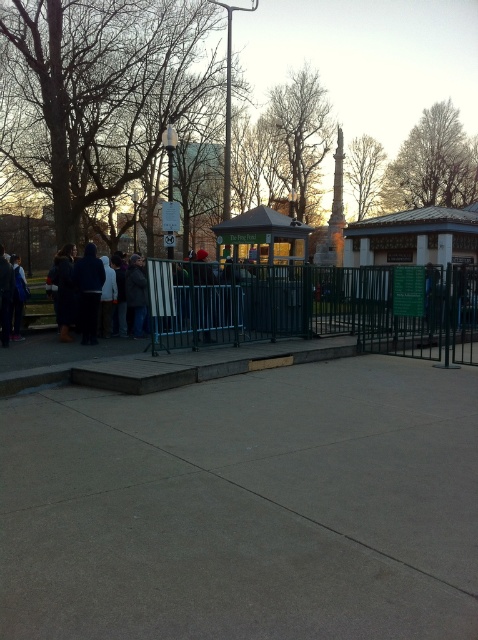
Does gray concrete sidewalk at center have a lesser width compared to green metal fence at center?

No.

Where is `gray concrete sidewalk at center`? The width and height of the screenshot is (478, 640). gray concrete sidewalk at center is located at coordinates pos(322,458).

Who is taller, green metal fence at center or dark blue jacket at left?

dark blue jacket at left

Is green metal fence at center positioned in front of dark blue jacket at left?

Yes.

Is point (294, 296) in front of point (23, 285)?

That is False.

Image resolution: width=478 pixels, height=640 pixels. I want to click on green metal fence at center, so click(x=317, y=308).

In the scene shown: Is dark blue jacket at center wider than dark blue jacket at left?

Correct, the width of dark blue jacket at center exceeds that of dark blue jacket at left.

Does dark blue jacket at center have a greater height compared to dark blue jacket at left?

Yes, dark blue jacket at center is taller than dark blue jacket at left.

Which is behind, point (95, 289) or point (17, 273)?

The point (17, 273) is behind.

Identify the location of dark blue jacket at center. This screenshot has height=640, width=478. (88, 291).